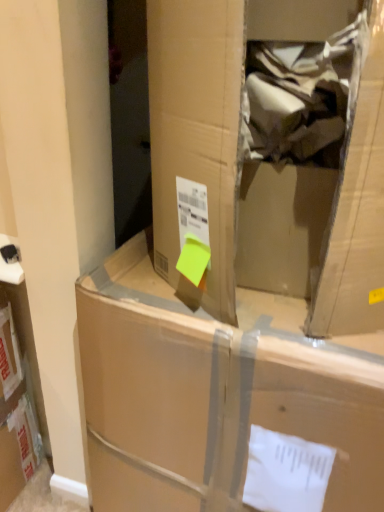
Describe the element at coordinates (271, 148) in the screenshot. The image size is (384, 512). I see `brown cardboard box at center` at that location.

This screenshot has height=512, width=384. In order to click on brown cardboard box at center in this screenshot , I will do `click(271, 148)`.

The image size is (384, 512). What are the coordinates of `cardboard box at center` in the screenshot? It's located at (215, 393).

Measure the distance between cardboard box at center and camera.

25.24 inches.

Image resolution: width=384 pixels, height=512 pixels. What do you see at coordinates (215, 393) in the screenshot?
I see `cardboard box at center` at bounding box center [215, 393].

The width and height of the screenshot is (384, 512). I want to click on brown cardboard box at center, so click(x=271, y=148).

Is brown cardboard box at center at the left side of cardboard box at center?

Incorrect, brown cardboard box at center is not on the left side of cardboard box at center.

In the image, is brown cardboard box at center positioned in front of or behind cardboard box at center?

Visually, brown cardboard box at center is located in front of cardboard box at center.

Which is in front, point (340, 331) or point (280, 348)?

Point (280, 348)

From the image's perspective, is brown cardboard box at center below cardboard box at center?

No, from the image's perspective, brown cardboard box at center is not below cardboard box at center.

From a real-world perspective, which object rests below the other?

cardboard box at center.

Considering the sizes of objects brown cardboard box at center and cardboard box at center in the image provided, who is thinner, brown cardboard box at center or cardboard box at center?

brown cardboard box at center is thinner.

Does brown cardboard box at center have a greater height compared to cardboard box at center?

Incorrect, the height of brown cardboard box at center is not larger of that of cardboard box at center.

Can you confirm if brown cardboard box at center is smaller than cardboard box at center?

Result: Indeed, brown cardboard box at center has a smaller size compared to cardboard box at center.

Can cardboard box at center be found inside brown cardboard box at center?

That's incorrect, cardboard box at center is not inside brown cardboard box at center.

Is brown cardboard box at center in contact with cardboard box at center?

brown cardboard box at center is not next to cardboard box at center, and they're not touching.

In the scene shown: Could you tell me if brown cardboard box at center is turned towards cardboard box at center?

No.

Identify the location of cardboard box above the cardboard box at center (from the image's perspective). (271, 148).

Which is more to the right, cardboard box at center or brown cardboard box at center?

brown cardboard box at center.

Is cardboard box at center closer to the viewer compared to brown cardboard box at center?

No, it is not.

Considering the positions of point (109, 489) and point (167, 123), is point (109, 489) closer or farther from the camera than point (167, 123)?

Clearly, point (109, 489) is more distant from the camera than point (167, 123).

From the image's perspective, between cardboard box at center and brown cardboard box at center, which one is located above?

brown cardboard box at center is shown above in the image.

From a real-world perspective, is cardboard box at center positioned under brown cardboard box at center based on gravity?

Yes.

Between cardboard box at center and brown cardboard box at center, which one has smaller width?

brown cardboard box at center.

Considering the relative sizes of cardboard box at center and brown cardboard box at center in the image provided, is cardboard box at center shorter than brown cardboard box at center?

No.

Is cardboard box at center bigger than brown cardboard box at center?

Correct, cardboard box at center is larger in size than brown cardboard box at center.

Is brown cardboard box at center completely or partially inside cardboard box at center?

No, brown cardboard box at center is not a part of cardboard box at center.

In the scene shown: Is cardboard box at center not near brown cardboard box at center?

cardboard box at center is actually quite close to brown cardboard box at center.

Is cardboard box at center looking in the opposite direction of brown cardboard box at center?

That's not correct — cardboard box at center is not looking away from brown cardboard box at center.

How different are the orientations of cardboard box at center and brown cardboard box at center in degrees?

9.35 degrees.

Consider the image. Measure the distance between cardboard box at center and brown cardboard box at center.

cardboard box at center is 9.53 inches from brown cardboard box at center.

Where is `cardboard box that is on the right side of cardboard box at center`? This screenshot has width=384, height=512. cardboard box that is on the right side of cardboard box at center is located at coordinates [x=271, y=148].

At what (x,y) coordinates should I click in order to perform the action: click on box to the left of brown cardboard box at center. Please return your answer as a coordinate pair (x, y). Looking at the image, I should click on (215, 393).

This screenshot has height=512, width=384. Find the location of `cardboard box above the cardboard box at center (from a real-world perspective)`. cardboard box above the cardboard box at center (from a real-world perspective) is located at coordinates (271, 148).